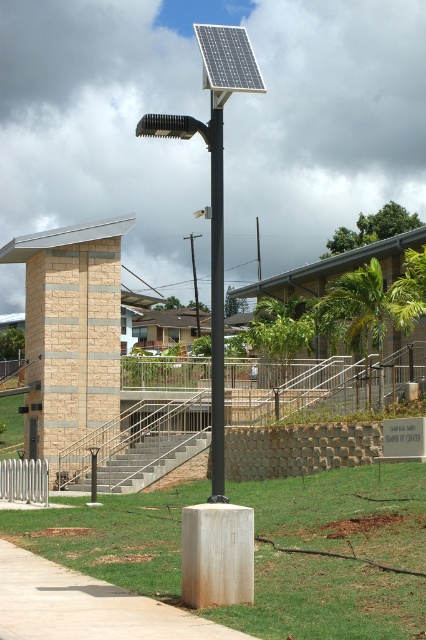
Question: Which object is farther from the camera taking this photo?

Choices:
 (A) smooth concrete sidewalk at lower left
 (B) black metal pole at center

Answer: (B)

Question: Can you confirm if smooth concrete sidewalk at lower left is positioned to the right of black matte solar panel at center?

Choices:
 (A) yes
 (B) no

Answer: (A)

Question: Among these objects, which one is nearest to the camera?

Choices:
 (A) black metal pole at center
 (B) smooth concrete sidewalk at lower left
 (C) black matte solar panel at center

Answer: (B)

Question: Which object is closer to the camera taking this photo?

Choices:
 (A) silver textured solar panel at upper center
 (B) black metal pole at center

Answer: (A)

Question: Can you confirm if black matte solar panel at center is smaller than black metal pole at center?

Choices:
 (A) yes
 (B) no

Answer: (B)

Question: Does black matte solar panel at center come in front of black metal pole at center?

Choices:
 (A) yes
 (B) no

Answer: (A)